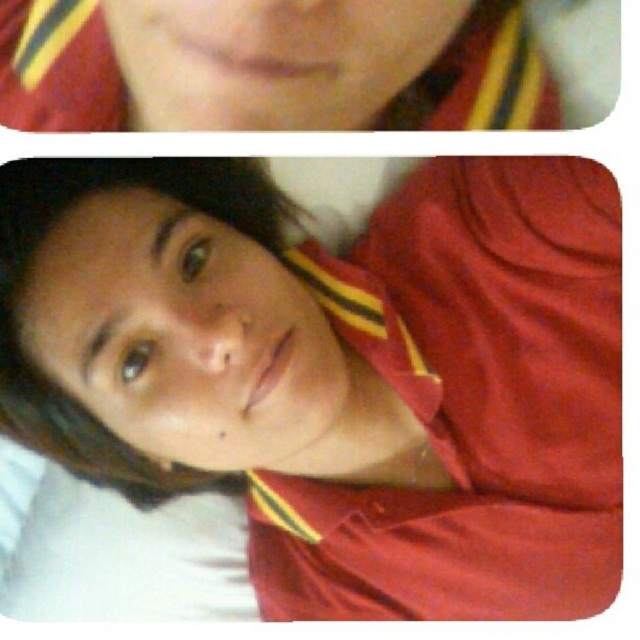
Who is shorter, matte red shirt at center or matte red shirt at upper center?

matte red shirt at upper center is shorter.

Does matte red shirt at center appear over matte red shirt at upper center?

Incorrect, matte red shirt at center is not positioned above matte red shirt at upper center.

What do you see at coordinates (337, 371) in the screenshot? This screenshot has height=640, width=640. I see `matte red shirt at center` at bounding box center [337, 371].

Find the location of a particular element. The height and width of the screenshot is (640, 640). matte red shirt at center is located at coordinates (337, 371).